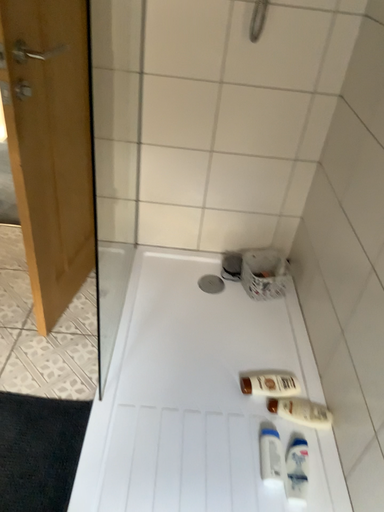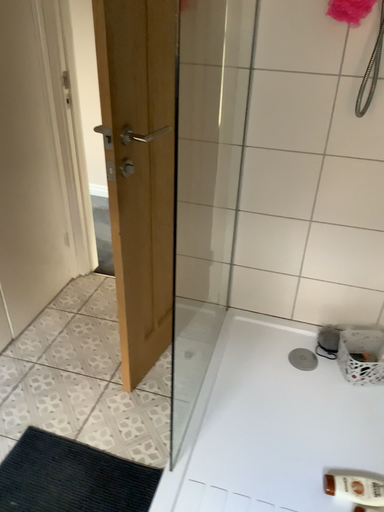
Question: Which way did the camera rotate in the video?

Choices:
 (A) rotated right
 (B) rotated left

Answer: (B)